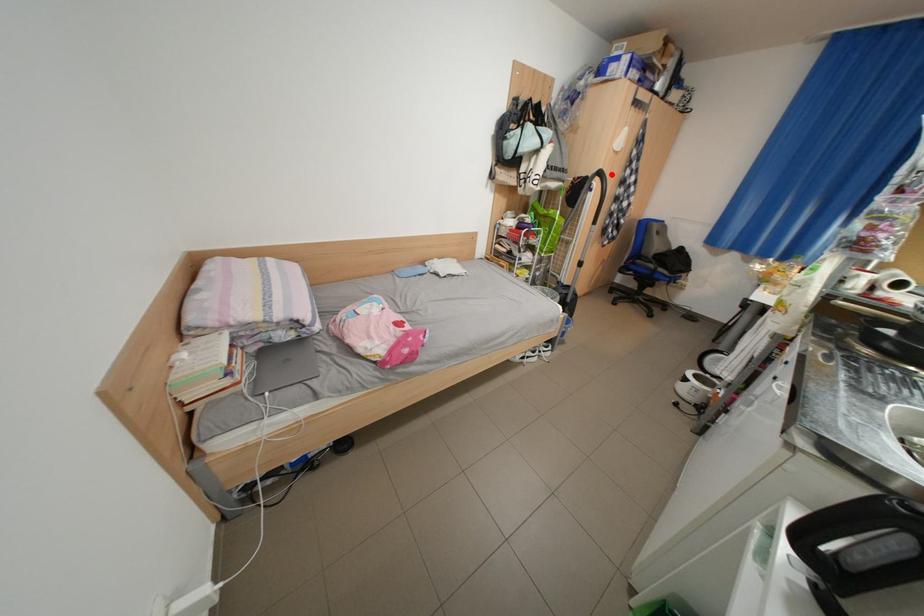
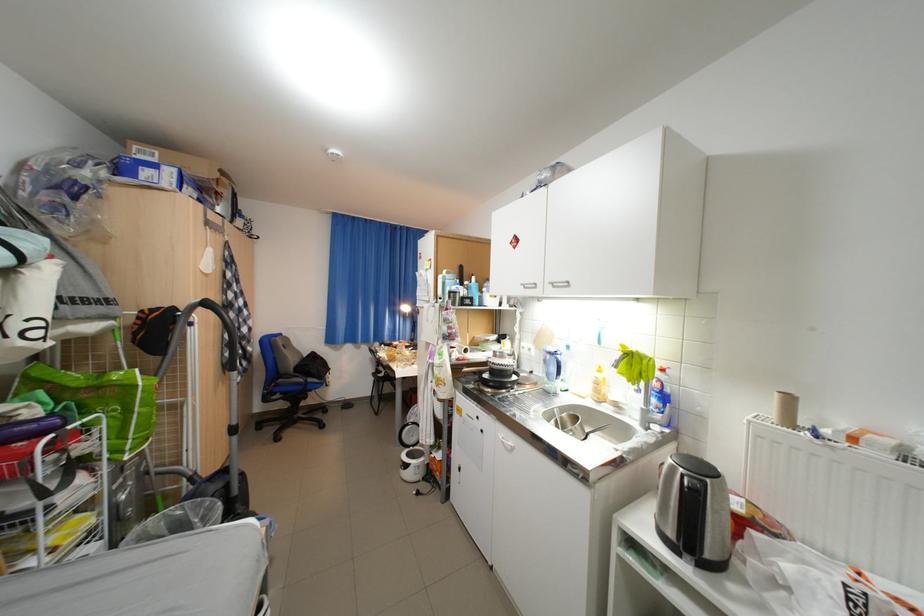
The point at the highlighted location is marked in the first image. Where is the corresponding point in the second image?

(217, 305)